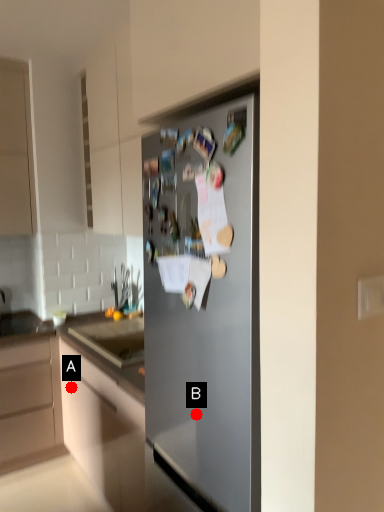
Question: Two points are circled on the image, labeled by A and B beside each circle. Among these points, which one is farthest from the camera?

Choices:
 (A) A is further
 (B) B is further

Answer: (A)